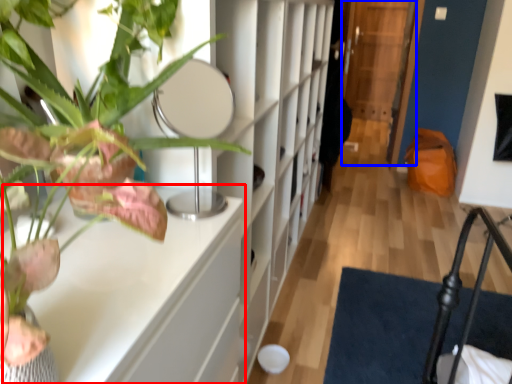
Question: Which object appears closest to the camera in this image, table (highlighted by a red box) or glass door (highlighted by a blue box)?

Choices:
 (A) table
 (B) glass door

Answer: (A)